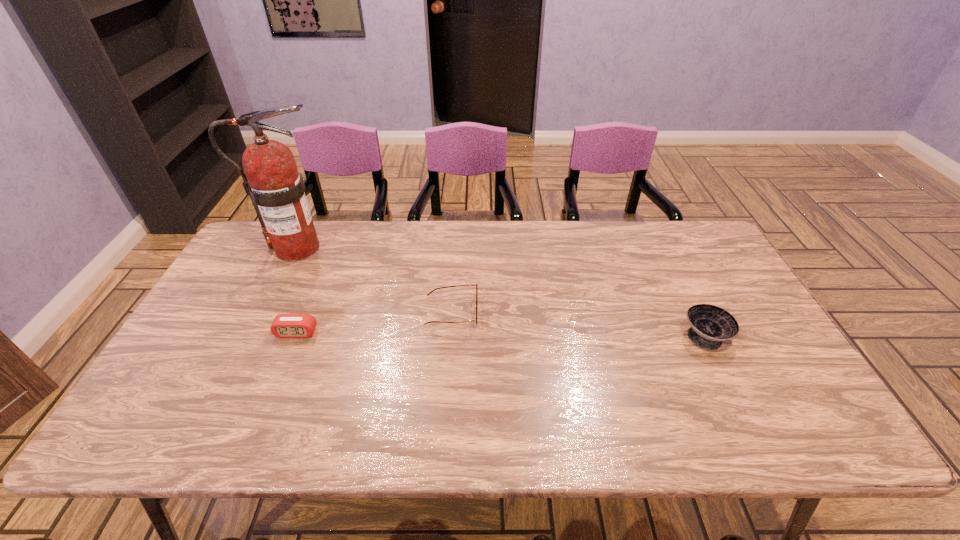
This screenshot has height=540, width=960. In order to click on vacant space that is in between the farthest object and the spectacles in this screenshot , I will do `click(374, 281)`.

This screenshot has width=960, height=540. In order to click on free space between the alarm clock and the spectacles in this screenshot , I will do `click(374, 323)`.

This screenshot has width=960, height=540. I want to click on free space that is in between the alarm clock and the rightmost object, so click(501, 334).

This screenshot has height=540, width=960. I want to click on free spot between the second object from right to left and the bowl, so click(x=579, y=325).

Locate an element on the screen. Image resolution: width=960 pixels, height=540 pixels. vacant space that is in between the third object from left to right and the rightmost object is located at coordinates (579, 325).

The height and width of the screenshot is (540, 960). What are the coordinates of `vacant area that lies between the rightmost object and the fire extinguisher` in the screenshot? It's located at (501, 292).

In order to click on vacant space that's between the rightmost object and the spectacles in this screenshot , I will do `click(579, 325)`.

Identify which object is the second nearest to the bowl. Please provide its 2D coordinates. Your answer should be formatted as a tuple, i.e. [(x, y)], where the tuple contains the x and y coordinates of a point satisfying the conditions above.

[(284, 325)]

I want to click on object that is the closest to the rightmost object, so click(476, 285).

The height and width of the screenshot is (540, 960). What are the coordinates of `vacant space that satisfies the following two spatial constraints: 1. on the face of the second object from right to left; 2. on the front-facing side of the alarm clock` in the screenshot? It's located at (450, 333).